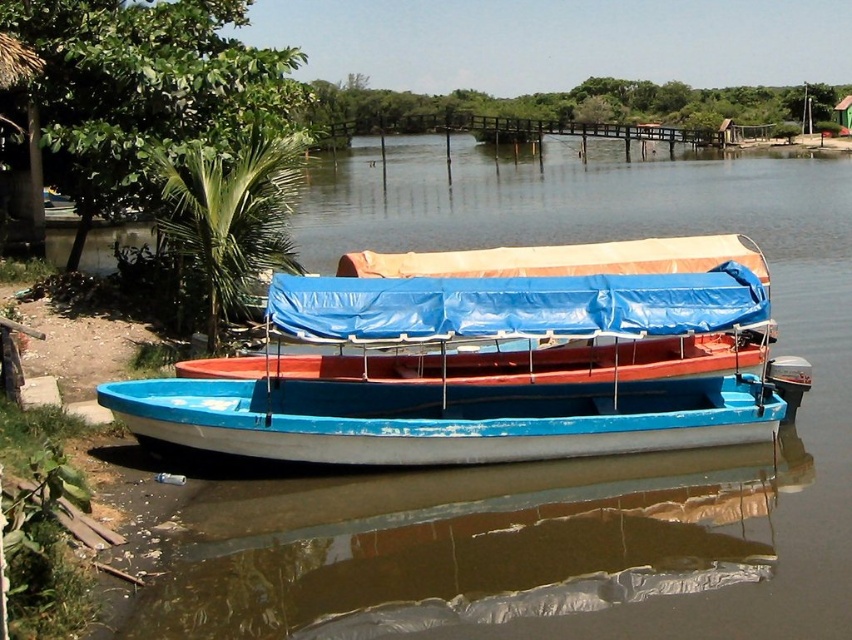
Based on the photo, you are standing at the edge of the river and want to locate the blue plastic boat at center. According to the coordinates provided, where exactly is it positioned?

The blue plastic boat at center is positioned at coordinates point [490,360].

You are standing on the wooden pier and see both the blue plastic boat at center and the blue painted wood canoe at center. Which boat is closer to you?

The blue plastic boat at center is closer to you because it is positioned above the blue painted wood canoe at center, indicating it is in front.